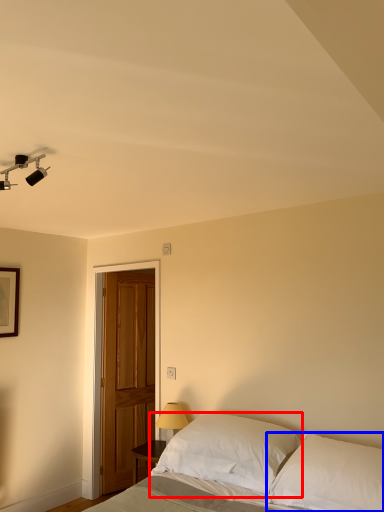
Question: Which object appears closest to the camera in this image, pillow (highlighted by a red box) or pillow (highlighted by a blue box)?

Choices:
 (A) pillow
 (B) pillow

Answer: (B)